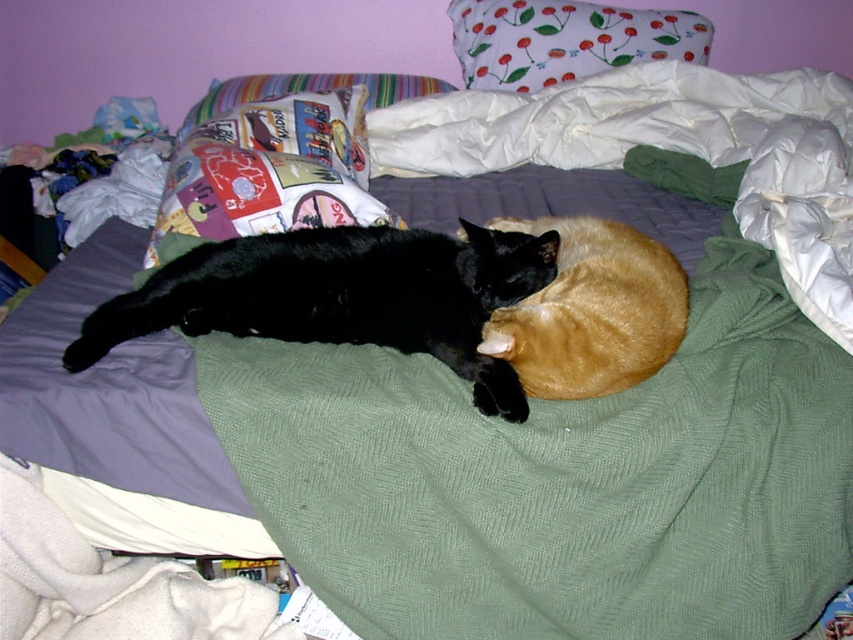
You are a photographer trying to capture a photo of the black fur cat at center and the multicolored fabric pillow at upper left. From which side of the bed should you position yourself to ensure both subjects are fully visible in the frame?

You should position yourself on the side of the bed opposite to the multicolored fabric pillow at upper left so that both the black fur cat at center and the multicolored fabric pillow at upper left are visible. Since the black fur cat at center is located below the multicolored fabric pillow at upper left, positioning yourself opposite to the pillow allows you to see both the cat and the pillow in the frame.

You are a cat owner who wants to place a new cat toy between the black fur cat at center and the multicolored fabric pillow at upper left. Which object is shorter so that the toy can be placed closer to it?

The black fur cat at center has a lesser height compared to the multicolored fabric pillow at upper left, so the toy should be placed closer to the black fur cat at center.